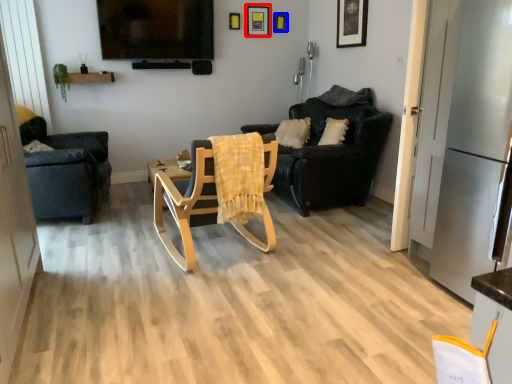
Question: Among these objects, which one is nearest to the camera, picture frame (highlighted by a red box) or picture frame (highlighted by a blue box)?

Choices:
 (A) picture frame
 (B) picture frame

Answer: (A)